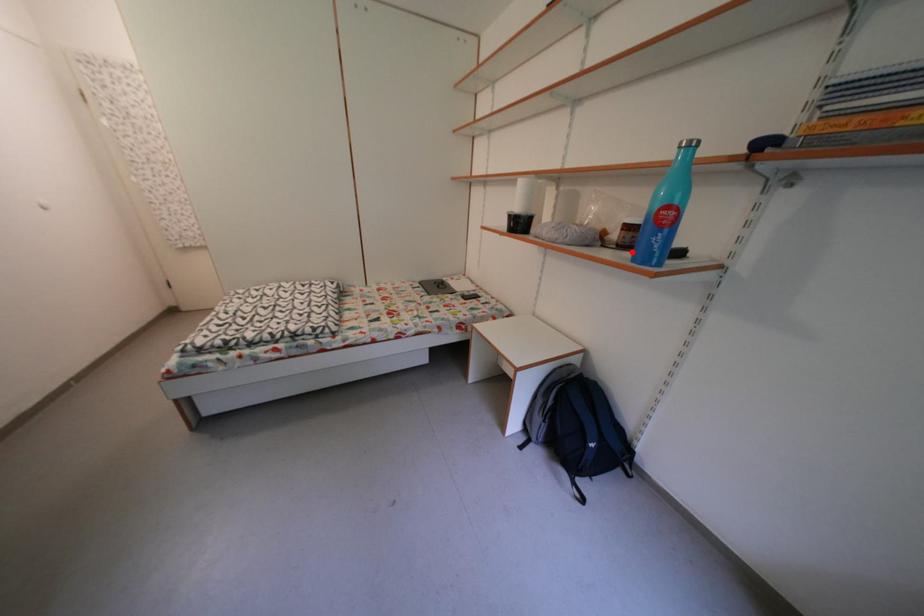
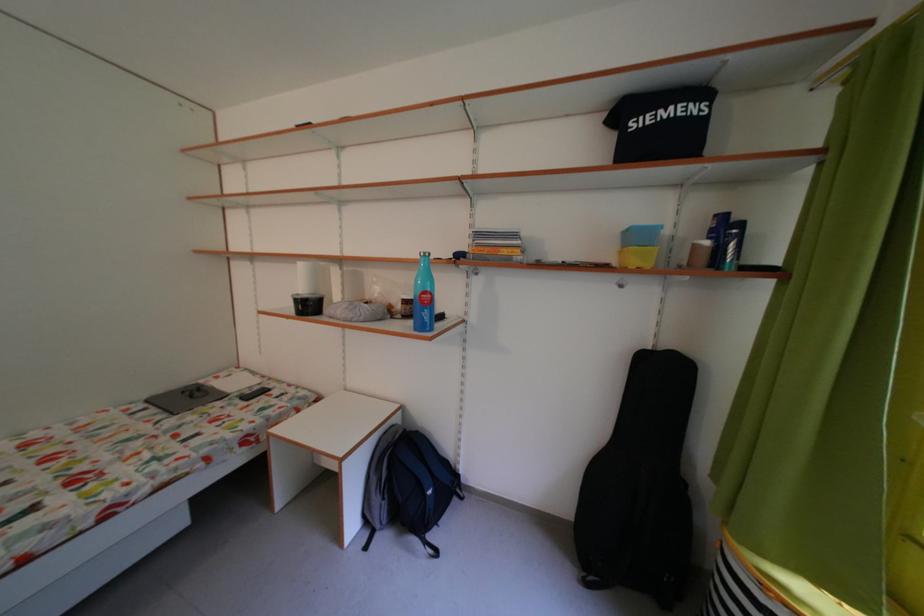
The point at the highlighted location is marked in the first image. Where is the corresponding point in the second image?

(416, 322)